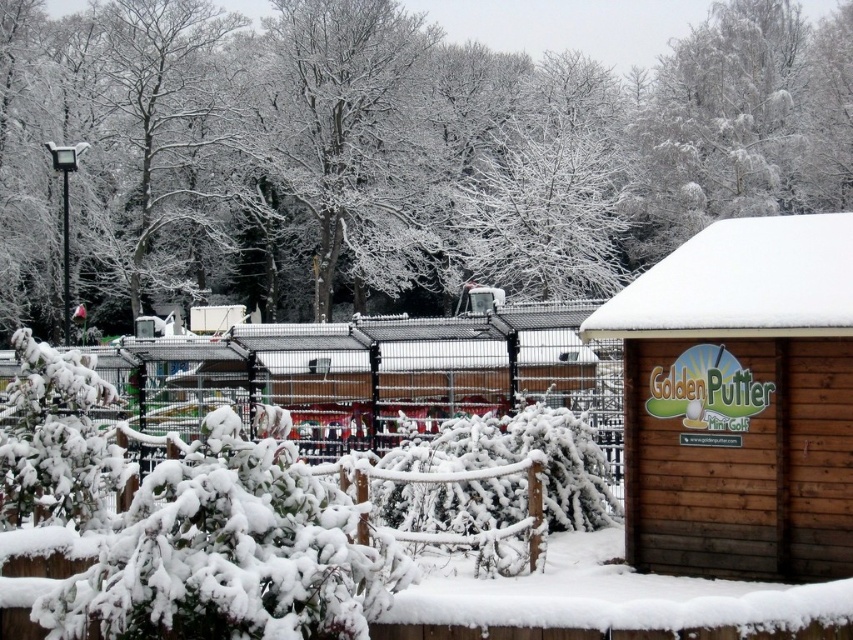
You are planning to place a new bench in the winter scene. The bench requires a space wider than the wooden hut at right. Can the white frosty tree at upper center provide enough space for the bench?

The wooden hut at right has a lesser width compared to the white frosty tree at upper center, so the space under the white frosty tree at upper center is wider and can accommodate the bench.